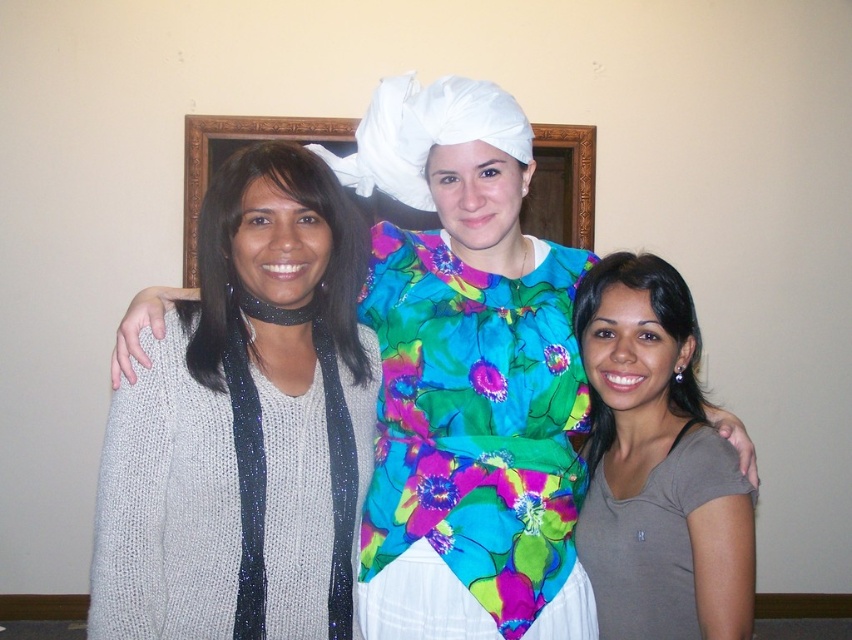
You are organizing a photoshoot and need to ensure that the gray matte shirt at center and the white fabric at center are visible in the frame. Given their sizes, which object should you focus on to ensure both are in the shot?

The gray matte shirt at center is smaller than the white fabric at center, so focusing on the larger white fabric at center would help ensure both are visible in the frame.

You are standing in front of the three people in the image. You want to place a small gift on the floor between the two points labeled as point [142,401] and point [537,173]. Which point should you place the gift closer to in order to be nearer to the person in the center wearing the colorful floral dress?

To place the gift closer to the person in the center wearing the colorful floral dress, you should position it nearer to point [142,401] since it is closer to the viewer compared to point [537,173].

You are a photographer setting up for a group photo. You need to ensure that the floral print fabric dress at center and the white fabric at center are both visible in the shot. Based on their positions, which one is lower in the frame?

The floral print fabric dress at center is below the white fabric at center, so the floral print fabric dress at center is lower in the frame.